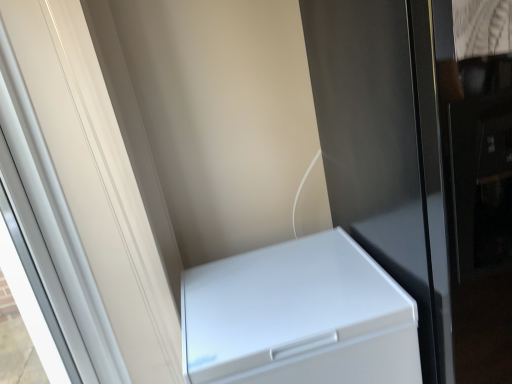
Question: Does white glossy screen door at left, the 1th screen door from the left, contain white matte refrigerator at lower right?

Choices:
 (A) no
 (B) yes

Answer: (A)

Question: Can you confirm if white glossy screen door at left, the second screen door in the right-to-left sequence, is thinner than white matte refrigerator at lower right?

Choices:
 (A) yes
 (B) no

Answer: (A)

Question: Is white glossy screen door at left, the 1th screen door from the left, touching white matte refrigerator at lower right?

Choices:
 (A) yes
 (B) no

Answer: (B)

Question: Can you confirm if white glossy screen door at left, the second screen door in the right-to-left sequence, is wider than white matte refrigerator at lower right?

Choices:
 (A) no
 (B) yes

Answer: (A)

Question: Is white glossy screen door at left, the 1th screen door from the left, closer to camera compared to white matte refrigerator at lower right?

Choices:
 (A) yes
 (B) no

Answer: (A)

Question: Based on their positions, is glossy black screen door at lower right, the first screen door from the right, located to the left or right of white glossy screen door at left, the 1th screen door from the left?

Choices:
 (A) right
 (B) left

Answer: (A)

Question: Looking at the image, does glossy black screen door at lower right, the first screen door from the right, seem bigger or smaller compared to white glossy screen door at left, the 1th screen door from the left?

Choices:
 (A) small
 (B) big

Answer: (B)

Question: Considering the positions of point (442, 274) and point (173, 355), is point (442, 274) closer or farther from the camera than point (173, 355)?

Choices:
 (A) farther
 (B) closer

Answer: (B)

Question: From a real-world perspective, is glossy black screen door at lower right, which is the 2th screen door from left to right, above or below white glossy screen door at left, the second screen door in the right-to-left sequence?

Choices:
 (A) above
 (B) below

Answer: (B)

Question: Do you think white matte refrigerator at lower right is within white glossy screen door at left, the 1th screen door from the left, or outside of it?

Choices:
 (A) outside
 (B) inside

Answer: (A)

Question: Considering the positions of white matte refrigerator at lower right and white glossy screen door at left, the 1th screen door from the left, in the image, is white matte refrigerator at lower right taller or shorter than white glossy screen door at left, the 1th screen door from the left,?

Choices:
 (A) short
 (B) tall

Answer: (A)

Question: Is white matte refrigerator at lower right bigger or smaller than white glossy screen door at left, the second screen door in the right-to-left sequence?

Choices:
 (A) small
 (B) big

Answer: (B)

Question: From the image's perspective, relative to white glossy screen door at left, the 1th screen door from the left, is white matte refrigerator at lower right above or below?

Choices:
 (A) below
 (B) above

Answer: (A)

Question: Visually, is white glossy screen door at left, the 1th screen door from the left, positioned to the left or to the right of white matte refrigerator at lower right?

Choices:
 (A) left
 (B) right

Answer: (A)

Question: From the image's perspective, relative to white matte refrigerator at lower right, is white glossy screen door at left, the second screen door in the right-to-left sequence, above or below?

Choices:
 (A) above
 (B) below

Answer: (A)